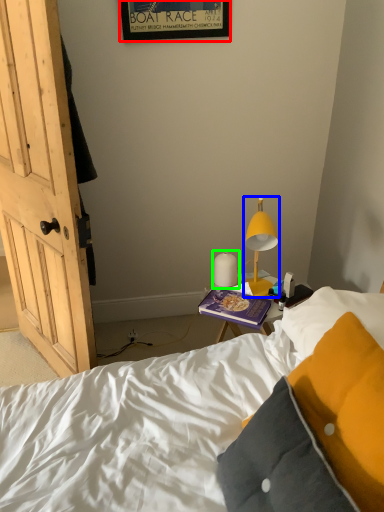
Question: Based on their relative distances, which object is nearer to picture frame (highlighted by a red box)? Choose from lamp (highlighted by a blue box) and lamp (highlighted by a green box).

Choices:
 (A) lamp
 (B) lamp

Answer: (A)